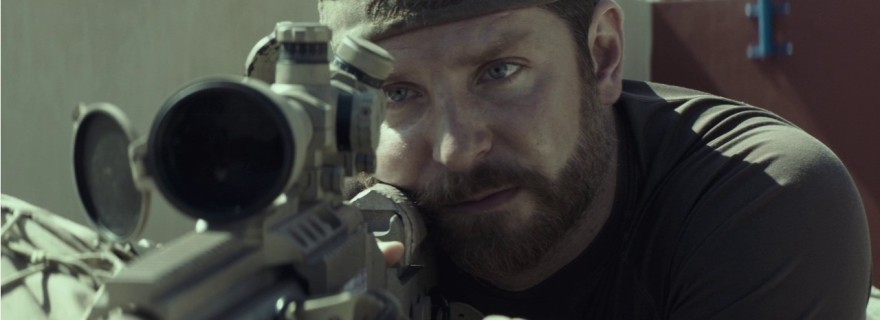
This screenshot has height=320, width=880. Identify the location of door handle. (768, 26).